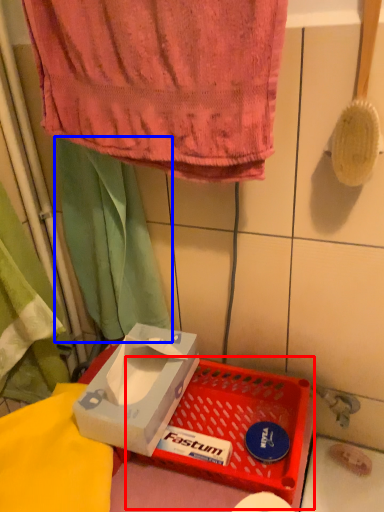
Question: Among these objects, which one is farthest to the camera, basket (highlighted by a red box) or curtain (highlighted by a blue box)?

Choices:
 (A) basket
 (B) curtain

Answer: (B)